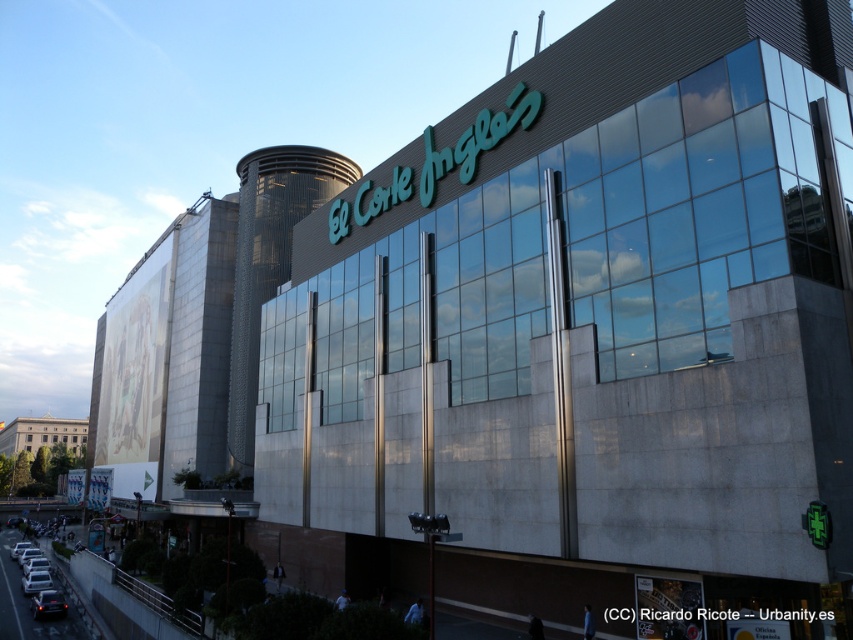
Is metallic silver car at lower left closer to camera compared to silver metallic car at lower left?

Yes, metallic silver car at lower left is closer to the viewer.

Where is `metallic silver car at lower left`? metallic silver car at lower left is located at coordinates (48, 604).

Identify the location of metallic silver car at lower left. (48, 604).